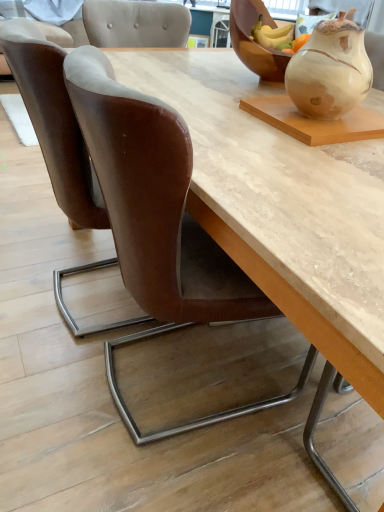
Identify the location of free space in front of matte ceramic vase at upper right. (324, 147).